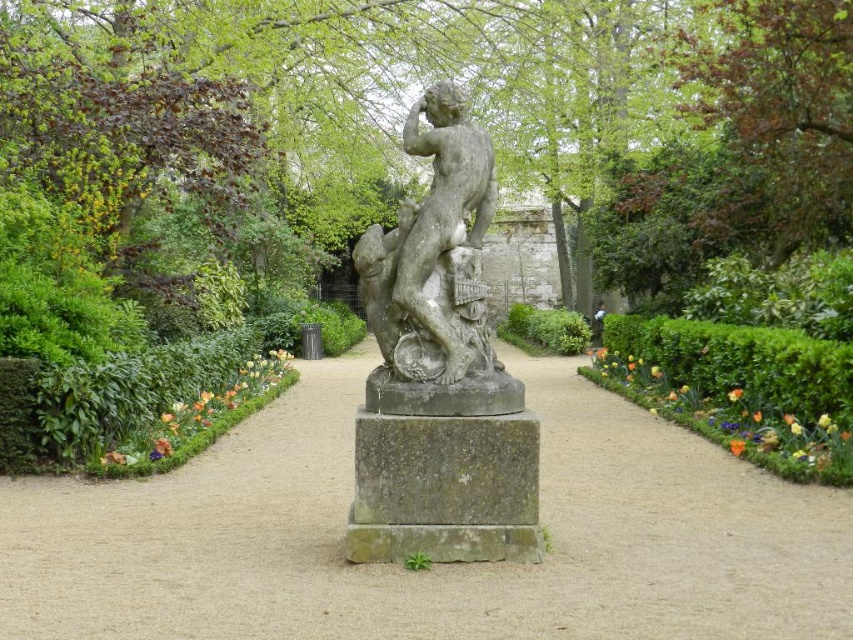
Question: Among these objects, which one is farthest from the camera?

Choices:
 (A) gray stone path at center
 (B) gray stone statue at center

Answer: (B)

Question: Can you confirm if gray stone path at center is positioned to the right of gray stone statue at center?

Choices:
 (A) no
 (B) yes

Answer: (B)

Question: Which object appears closest to the camera in this image?

Choices:
 (A) gray stone path at center
 (B) gray stone statue at center

Answer: (A)

Question: Does gray stone path at center appear under gray stone statue at center?

Choices:
 (A) no
 (B) yes

Answer: (B)

Question: Where is gray stone path at center located in relation to gray stone statue at center in the image?

Choices:
 (A) right
 (B) left

Answer: (A)